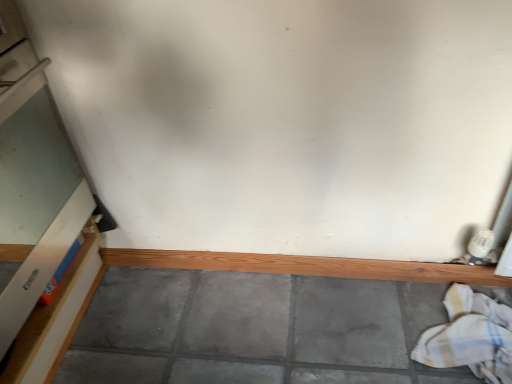
What do you see at coordinates (306, 266) in the screenshot? I see `wooden at bottom` at bounding box center [306, 266].

The width and height of the screenshot is (512, 384). I want to click on white cardboard box at left, so click(x=56, y=318).

From a real-world perspective, relative to white cardboard box at left, is white cotton laundry at lower right vertically above or below?

In terms of real-world spatial position, white cotton laundry at lower right is below white cardboard box at left.

Considering the relative sizes of white cotton laundry at lower right and white cardboard box at left in the image provided, is white cotton laundry at lower right smaller than white cardboard box at left?

No, white cotton laundry at lower right is not smaller than white cardboard box at left.

Does white cotton laundry at lower right have a greater height compared to white cardboard box at left?

Indeed, white cotton laundry at lower right has a greater height compared to white cardboard box at left.

Which is more to the right, white cotton laundry at lower right or white cardboard box at left?

From the viewer's perspective, white cotton laundry at lower right appears more on the right side.

From a real-world perspective, is wooden at bottom below white cotton laundry at lower right?

Yes, from a real-world perspective, wooden at bottom is under white cotton laundry at lower right.

Is wooden at bottom closer to the viewer compared to white cotton laundry at lower right?

That is False.

Are wooden at bottom and white cotton laundry at lower right located far from each other?

No, wooden at bottom is not far away from white cotton laundry at lower right.

Which point is more forward, (448,265) or (471,315)?

The point (471,315) is in front.

Is white cotton laundry at lower right closer to the viewer compared to wooden at bottom?

Yes, the depth of white cotton laundry at lower right is less than that of wooden at bottom.

Considering the positions of point (475, 313) and point (139, 266), is point (475, 313) closer or farther from the camera than point (139, 266)?

Point (475, 313) is closer to the camera than point (139, 266).

Could you tell me if white cardboard box at left is facing wooden at bottom?

No.

Can you confirm if white cardboard box at left is smaller than wooden at bottom?

No.

Where is `shelf that appears above the wooden at bottom (from the image's perspective)`? This screenshot has height=384, width=512. shelf that appears above the wooden at bottom (from the image's perspective) is located at coordinates (56, 318).

From the image's perspective, which one is positioned lower, white cardboard box at left or wooden at bottom?

wooden at bottom appears lower in the image.

Which is correct: white cardboard box at left is inside white cotton laundry at lower right, or outside of it?

white cardboard box at left is not enclosed by white cotton laundry at lower right.

Which object is wider, white cardboard box at left or white cotton laundry at lower right?

white cardboard box at left.

Measure the distance between white cardboard box at left and white cotton laundry at lower right.

white cardboard box at left is 36.78 inches from white cotton laundry at lower right.

From their relative heights in the image, would you say white cardboard box at left is taller or shorter than white cotton laundry at lower right?

Considering their sizes, white cardboard box at left has less height than white cotton laundry at lower right.

From the image's perspective, between wooden at bottom and white cardboard box at left, which one is located above?

white cardboard box at left appears higher in the image.

Can you tell me how much wooden at bottom and white cardboard box at left differ in facing direction?

The angle between the facing direction of wooden at bottom and the facing direction of white cardboard box at left is 90.1 degrees.

Would you consider wooden at bottom to be distant from white cardboard box at left?

wooden at bottom is near white cardboard box at left, not far away.

Is white cardboard box at left at the back of wooden at bottom?

No, wooden at bottom is not facing the opposite direction of white cardboard box at left.

You are a GUI agent. You are given a task and a screenshot of the screen. Output one action in this format:
    pyautogui.click(x=<x>, y=<y>)
    Task: Click on the laundry beneath the white cardboard box at left (from a real-world perspective)
    
    Given the screenshot: What is the action you would take?
    pyautogui.click(x=470, y=336)

You are a GUI agent. You are given a task and a screenshot of the screen. Output one action in this format:
    pyautogui.click(x=<x>, y=<y>)
    Task: Click on the ledge on the left of white cotton laundry at lower right
    
    Given the screenshot: What is the action you would take?
    pyautogui.click(x=306, y=266)

From the image, which object appears to be nearer to white cardboard box at left, wooden at bottom or white cotton laundry at lower right?

Among the two, wooden at bottom is located nearer to white cardboard box at left.

Estimate the real-world distances between objects in this image. Which object is closer to wooden at bottom, white cotton laundry at lower right or white cardboard box at left?

white cotton laundry at lower right lies closer to wooden at bottom than the other object.

Based on their spatial positions, is white cardboard box at left or wooden at bottom further from white cotton laundry at lower right?

white cardboard box at left is positioned further to the anchor white cotton laundry at lower right.

From the image, which object appears to be nearer to wooden at bottom, white cardboard box at left or white cotton laundry at lower right?

white cotton laundry at lower right is positioned closer to the anchor wooden at bottom.

When comparing their distances from white cardboard box at left, does white cotton laundry at lower right or wooden at bottom seem further?

white cotton laundry at lower right.

When comparing their distances from white cotton laundry at lower right, does wooden at bottom or white cardboard box at left seem closer?

wooden at bottom is closer to white cotton laundry at lower right.

Identify the location of ledge between white cardboard box at left and white cotton laundry at lower right from left to right. This screenshot has height=384, width=512. (306, 266).